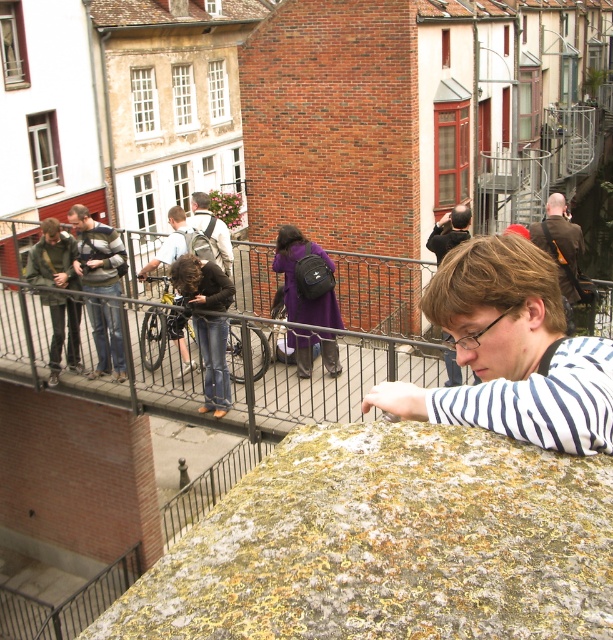
Does matte black backpack at left appear on the right side of denim jeans at center?

No, matte black backpack at left is not to the right of denim jeans at center.

Is point (80, 204) less distant than point (208, 346)?

That is False.

This screenshot has height=640, width=613. Identify the location of matte black backpack at left. (x=96, y=252).

Between point (333, 353) and point (438, 248), which one is positioned behind?

Positioned behind is point (438, 248).

Who is lower down, purple matte coat at center or matte black jacket at center?

purple matte coat at center is lower down.

Who is more forward, (327, 337) or (444, 221)?

Point (327, 337) is more forward.

Where is `purple matte coat at center`? purple matte coat at center is located at coordinates (306, 280).

Which of these two, matte black backpack at left or dark purple fabric coat at center, stands shorter?

dark purple fabric coat at center is shorter.

Can you confirm if matte black backpack at left is positioned above dark purple fabric coat at center?

Yes.

What are the coordinates of `matte black backpack at left` in the screenshot? It's located at (96, 252).